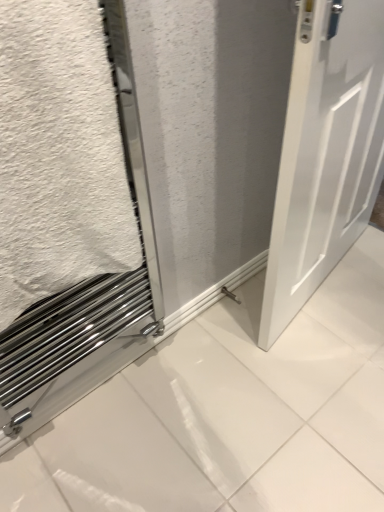
This screenshot has height=512, width=384. What do you see at coordinates (325, 152) in the screenshot?
I see `white matte door at right` at bounding box center [325, 152].

Measure the distance between point (363,178) and camera.

The distance of point (363,178) from camera is 4.57 feet.

The image size is (384, 512). I want to click on white matte door at right, so click(x=325, y=152).

The width and height of the screenshot is (384, 512). What are the coordinates of `white matte towel at lower left` in the screenshot? It's located at (59, 155).

This screenshot has height=512, width=384. Describe the element at coordinates (59, 155) in the screenshot. I see `white matte towel at lower left` at that location.

Identify the location of white matte door at right. (325, 152).

Considering the relative positions of white matte door at right and white matte towel at lower left in the image provided, is white matte door at right to the right of white matte towel at lower left from the viewer's perspective?

Correct, you'll find white matte door at right to the right of white matte towel at lower left.

Consider the image. Does white matte door at right come behind white matte towel at lower left?

Yes.

Considering the positions of points (336, 218) and (67, 89), is point (336, 218) closer to camera compared to point (67, 89)?

No, (336, 218) is further to viewer.

Based on the photo, from the image's perspective, relative to white matte towel at lower left, is white matte door at right above or below?

From the image's perspective, white matte door at right appears below white matte towel at lower left.

From a real-world perspective, is white matte door at right above or below white matte towel at lower left?

Clearly, from a real-world perspective, white matte door at right is below white matte towel at lower left.

Between white matte door at right and white matte towel at lower left, which one has smaller width?

Thinner between the two is white matte door at right.

Considering the relative sizes of white matte door at right and white matte towel at lower left in the image provided, is white matte door at right taller than white matte towel at lower left?

Correct, white matte door at right is much taller as white matte towel at lower left.

Does white matte door at right have a smaller size compared to white matte towel at lower left?

Actually, white matte door at right might be larger than white matte towel at lower left.

Is white matte towel at lower left a part of white matte door at right?

No, white matte towel at lower left is located outside of white matte door at right.

Are white matte door at right and white matte towel at lower left beside each other?

No, white matte door at right is not next to white matte towel at lower left.

Is white matte towel at lower left at the back of white matte door at right?

No, white matte towel at lower left is not at the back of white matte door at right.

Can you tell me how much white matte door at right and white matte towel at lower left differ in facing direction?

They differ by 10.7 degrees in their facing directions.

Where is `door directly beneath the white matte towel at lower left (from a real-world perspective)`? The height and width of the screenshot is (512, 384). door directly beneath the white matte towel at lower left (from a real-world perspective) is located at coordinates (325, 152).

Does white matte towel at lower left appear on the right side of white matte door at right?

No.

Which object is closer to the camera taking this photo, white matte towel at lower left or white matte door at right?

white matte towel at lower left.

Does point (109, 131) lie behind point (296, 62)?

No, (109, 131) is in front of (296, 62).

From the image's perspective, which one is positioned lower, white matte towel at lower left or white matte door at right?

white matte door at right, from the image's perspective.

From a real-world perspective, is white matte towel at lower left positioned above or below white matte door at right?

In terms of real-world spatial position, white matte towel at lower left is above white matte door at right.

Considering the relative sizes of white matte towel at lower left and white matte door at right in the image provided, is white matte towel at lower left wider than white matte door at right?

Indeed, white matte towel at lower left has a greater width compared to white matte door at right.

Can you confirm if white matte towel at lower left is taller than white matte door at right?

In fact, white matte towel at lower left may be shorter than white matte door at right.

Who is bigger, white matte towel at lower left or white matte door at right?

white matte door at right.

Is white matte towel at lower left completely or partially outside of white matte door at right?

Absolutely, white matte towel at lower left is external to white matte door at right.

Would you consider white matte towel at lower left to be distant from white matte door at right?

No, white matte towel at lower left is in close proximity to white matte door at right.

Does white matte towel at lower left turn towards white matte door at right?

No, white matte towel at lower left is not oriented towards white matte door at right.

The width and height of the screenshot is (384, 512). Find the location of `door located below the white matte towel at lower left (from the image's perspective)`. door located below the white matte towel at lower left (from the image's perspective) is located at coordinates pos(325,152).

Where is `door below the white matte towel at lower left (from the image's perspective)`? The width and height of the screenshot is (384, 512). door below the white matte towel at lower left (from the image's perspective) is located at coordinates (325, 152).

The image size is (384, 512). Identify the location of bath towel above the white matte door at right (from a real-world perspective). (59, 155).